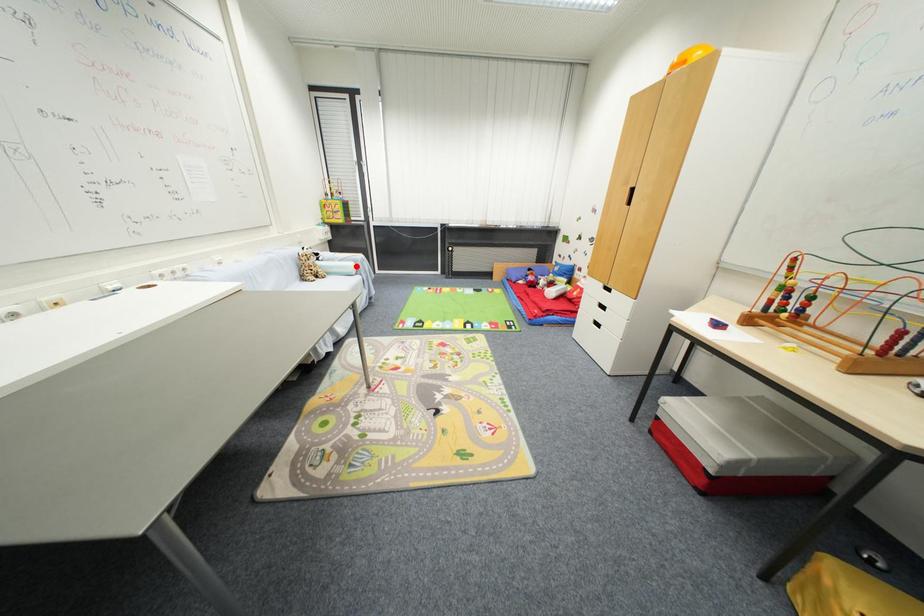
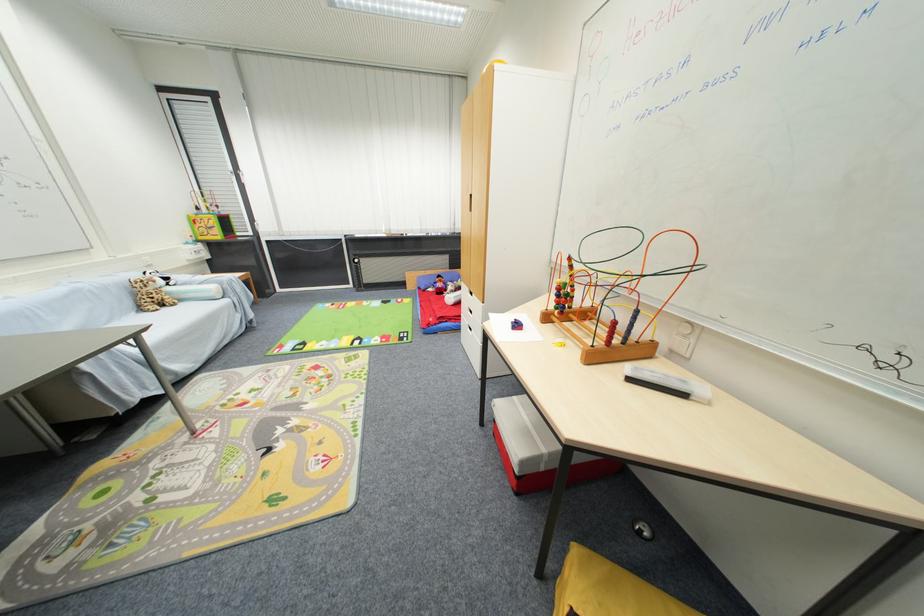
Question: I am providing you with two images of the same scene from different viewpoints. Image1 has a red point marked. In image2, the corresponding 3D location appears at what relative position? Reply with the corresponding letter.

Choices:
 (A) Closer
 (B) Farther

Answer: (B)